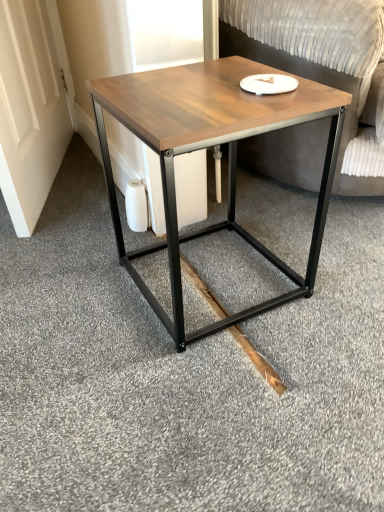
Question: Does point click(165, 141) appear closer or farther from the camera than point click(185, 270)?

Choices:
 (A) farther
 (B) closer

Answer: (B)

Question: In terms of size, does wooden matte coffee table at center appear bigger or smaller than natural wood plank at lower center?

Choices:
 (A) big
 (B) small

Answer: (A)

Question: Which of these objects is positioned closest to the natural wood plank at lower center?

Choices:
 (A) wooden matte coffee table at center
 (B) wooden swivel chair at center

Answer: (A)

Question: Considering the real-world distances, which object is farthest from the natural wood plank at lower center?

Choices:
 (A) wooden swivel chair at center
 (B) wooden matte coffee table at center

Answer: (A)